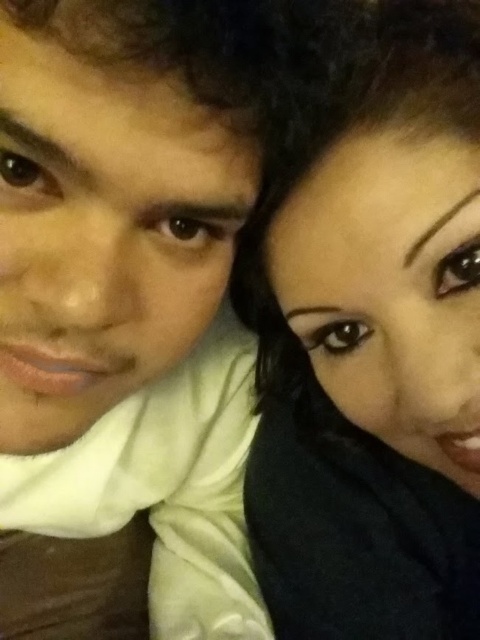
Which of these two, matte white scarf at upper left or black matte hair at upper right, stands shorter?

With less height is matte white scarf at upper left.

Is point (204, 284) positioned in front of point (380, 428)?

Yes, point (204, 284) is closer to viewer.

Locate an element on the screen. The height and width of the screenshot is (640, 480). matte white scarf at upper left is located at coordinates (126, 300).